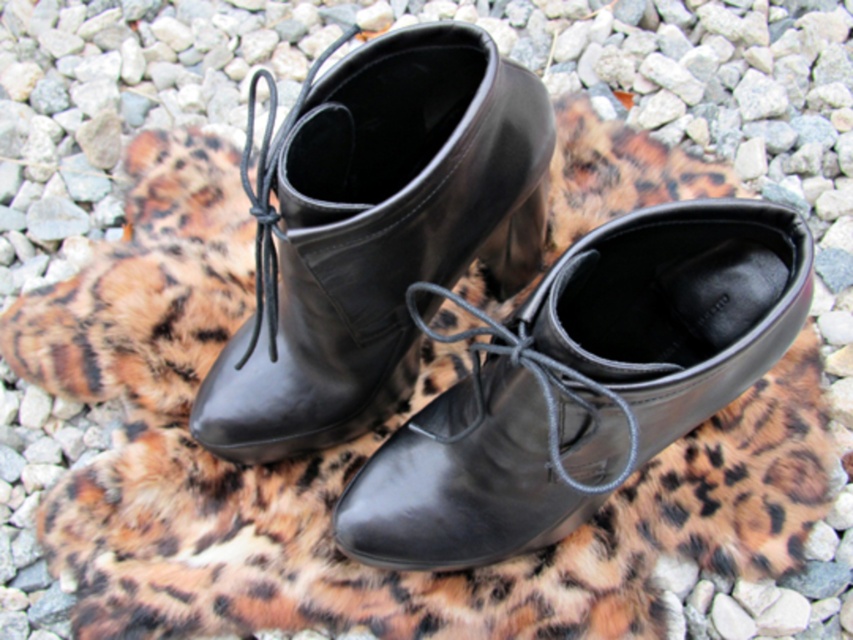
Is black leather shoe at center wider than shiny black boot at center?

Yes.

The width and height of the screenshot is (853, 640). What are the coordinates of `black leather shoe at center` in the screenshot? It's located at (585, 384).